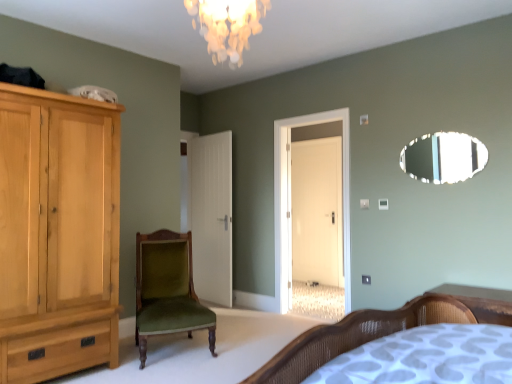
Locate an element on the screen. Image resolution: width=512 pixels, height=384 pixels. wooden bed at lower right is located at coordinates (482, 302).

Image resolution: width=512 pixels, height=384 pixels. Find the location of `oval glass mirror at upper right`. oval glass mirror at upper right is located at coordinates (443, 157).

Find the location of a particular element. iridescent glass chandelier at upper center is located at coordinates (227, 26).

The height and width of the screenshot is (384, 512). Find the location of `white matte door at center`. white matte door at center is located at coordinates (211, 215).

Locate an element on the screen. The width and height of the screenshot is (512, 384). wooden bed at lower right is located at coordinates (482, 302).

Relative to oval glass mirror at upper right, is white matte door at center in front or behind?

In the image, white matte door at center appears behind oval glass mirror at upper right.

From the picture: Considering the sizes of white matte door at center and oval glass mirror at upper right in the image, is white matte door at center taller or shorter than oval glass mirror at upper right?

Considering their sizes, white matte door at center has more height than oval glass mirror at upper right.

From a real-world perspective, between white matte door at center and oval glass mirror at upper right, who is vertically lower?

white matte door at center.

Find the location of a particular element. The width and height of the screenshot is (512, 384). mirror that is in front of the white matte door at center is located at coordinates (443, 157).

Which of these two, oval glass mirror at upper right or green velvet chair at center, stands shorter?

Standing shorter between the two is oval glass mirror at upper right.

Considering the relative positions of oval glass mirror at upper right and green velvet chair at center in the image provided, is oval glass mirror at upper right behind green velvet chair at center?

Yes, the depth of oval glass mirror at upper right is greater than that of green velvet chair at center.

Is oval glass mirror at upper right directly adjacent to green velvet chair at center?

They are not placed beside each other.

Does oval glass mirror at upper right turn towards green velvet chair at center?

No, oval glass mirror at upper right is not oriented towards green velvet chair at center.

How many degrees apart are the facing directions of white glossy door at center and wooden bed at lower right?

The angle between the facing direction of white glossy door at center and the facing direction of wooden bed at lower right is 1.25 degrees.

Does white glossy door at center turn towards wooden bed at lower right?

No, white glossy door at center is not turned towards wooden bed at lower right.

From a real-world perspective, is white glossy door at center positioned above or below wooden bed at lower right?

From a real-world perspective, white glossy door at center is physically above wooden bed at lower right.

Can we say white glossy door at center lies outside wooden bed at lower right?

Indeed, white glossy door at center is completely outside wooden bed at lower right.

From the image's perspective, is green velvet chair at center below oval glass mirror at upper right?

Indeed, from the image's perspective, green velvet chair at center is shown beneath oval glass mirror at upper right.

Where is `mirror above the green velvet chair at center (from the image's perspective)`? mirror above the green velvet chair at center (from the image's perspective) is located at coordinates (443, 157).

Considering the relative sizes of green velvet chair at center and oval glass mirror at upper right in the image provided, is green velvet chair at center bigger than oval glass mirror at upper right?

Indeed, green velvet chair at center has a larger size compared to oval glass mirror at upper right.

Is green velvet chair at center wider than oval glass mirror at upper right?

Yes.

Is green velvet chair at center facing away from white matte door at center?

No, green velvet chair at center's orientation is not away from white matte door at center.

Consider the image. Considering the sizes of green velvet chair at center and white matte door at center in the image, is green velvet chair at center bigger or smaller than white matte door at center?

Considering their sizes, green velvet chair at center takes up more space than white matte door at center.

Could white matte door at center be considered to be inside green velvet chair at center?

No, white matte door at center is not surrounded by green velvet chair at center.

From the image's perspective, is green velvet chair at center below white glossy door at center?

Yes, from the image's perspective, green velvet chair at center is below white glossy door at center.

Between green velvet chair at center and white glossy door at center, which one appears on the right side from the viewer's perspective?

white glossy door at center.

Looking at this image, how much distance is there between green velvet chair at center and white glossy door at center?

9.93 feet.

Is green velvet chair at center outside of white glossy door at center?

Yes.

Considering the relative sizes of white glossy door at center and green velvet chair at center in the image provided, is white glossy door at center taller than green velvet chair at center?

Indeed, white glossy door at center has a greater height compared to green velvet chair at center.

In the image, is white glossy door at center on the left side or the right side of green velvet chair at center?

Clearly, white glossy door at center is on the right of green velvet chair at center in the image.

Is white glossy door at center behind green velvet chair at center?

That is True.

Are white glossy door at center and green velvet chair at center making contact?

No, white glossy door at center is not making contact with green velvet chair at center.

Where is `door below the oval glass mirror at upper right (from the image's perspective)`? The width and height of the screenshot is (512, 384). door below the oval glass mirror at upper right (from the image's perspective) is located at coordinates (211, 215).

In the image, there is a oval glass mirror at upper right. In order to click on chair below it (from a real-world perspective) in this screenshot , I will do `click(167, 290)`.

Looking at the image, which one is located further to oval glass mirror at upper right, green velvet chair at center or iridescent glass chandelier at upper center?

green velvet chair at center is further to oval glass mirror at upper right.

Considering their positions, is oval glass mirror at upper right positioned closer to iridescent glass chandelier at upper center than white matte door at center?

oval glass mirror at upper right is positioned closer to the anchor iridescent glass chandelier at upper center.

Which object lies nearer to the anchor point wooden bed at lower right, white glossy door at center or white matte door at center?

Based on the image, white matte door at center appears to be nearer to wooden bed at lower right.

In the scene shown: Considering their positions, is iridescent glass chandelier at upper center positioned further to green velvet chair at center than white matte door at center?

iridescent glass chandelier at upper center is further to green velvet chair at center.

Considering their positions, is oval glass mirror at upper right positioned further to light wood cabinet at left than green velvet chair at center?

Based on the image, oval glass mirror at upper right appears to be further to light wood cabinet at left.

When comparing their distances from iridescent glass chandelier at upper center, does oval glass mirror at upper right or light wood cabinet at left seem closer?

light wood cabinet at left.

Looking at the image, which one is located closer to white matte door at center, wooden bed at lower right or light wood cabinet at left?

The object closer to white matte door at center is light wood cabinet at left.

From the image, which object appears to be nearer to green velvet chair at center, white glossy door at center or wooden bed at lower right?

wooden bed at lower right is positioned closer to the anchor green velvet chair at center.

Locate an element on the screen. The height and width of the screenshot is (384, 512). chair positioned between wooden bed at lower right and white glossy door at center from near to far is located at coordinates (167, 290).

The height and width of the screenshot is (384, 512). What are the coordinates of `light fixture between light wood cabinet at left and wooden bed at lower right from left to right` in the screenshot? It's located at (227, 26).

Locate an element on the screen. table positioned between iridescent glass chandelier at upper center and white glossy door at center from near to far is located at coordinates (482, 302).

This screenshot has height=384, width=512. What are the coordinates of `light fixture between light wood cabinet at left and oval glass mirror at upper right from left to right` in the screenshot? It's located at (227, 26).